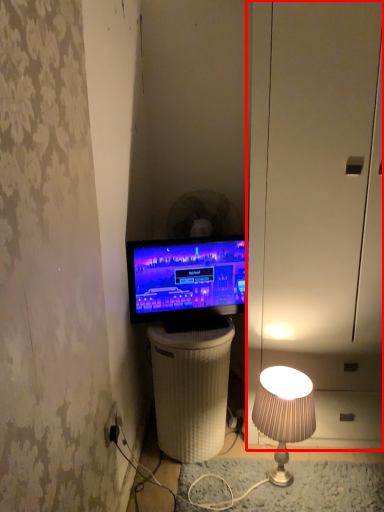
Question: Observing the image, what is the correct spatial positioning of dresser (annotated by the red box) in reference to mechanical fan?

Choices:
 (A) right
 (B) left

Answer: (A)